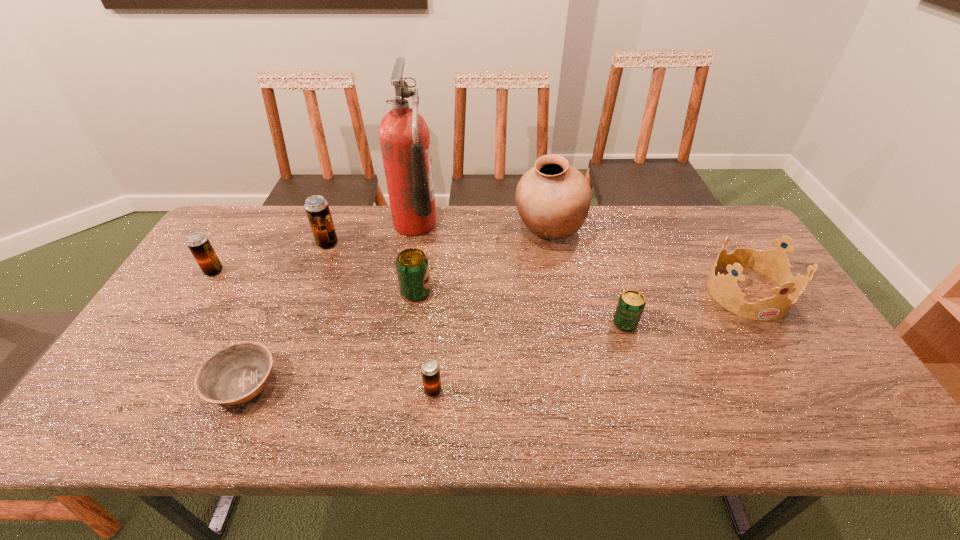
I want to click on red fire extinguisher, so click(x=404, y=137).

You are a GUI agent. You are given a task and a screenshot of the screen. Output one action in this format:
    pyautogui.click(x=<x>, y=<y>)
    Task: Click on the tallest object
    
    Given the screenshot: What is the action you would take?
    pyautogui.click(x=404, y=137)

Identify the location of the eighth shortest object. The width and height of the screenshot is (960, 540). (553, 198).

The image size is (960, 540). Find the location of `pottery`. pottery is located at coordinates (553, 198).

Where is `the farthest black beer can`? The height and width of the screenshot is (540, 960). the farthest black beer can is located at coordinates (317, 209).

The width and height of the screenshot is (960, 540). In order to click on the second beer can from left to right in this screenshot , I will do `click(317, 209)`.

The height and width of the screenshot is (540, 960). What are the coordinates of `tiara` in the screenshot? It's located at (773, 263).

In order to click on the leftmost object in this screenshot , I will do `click(198, 243)`.

I want to click on the second biggest black beer can, so click(x=198, y=243).

The width and height of the screenshot is (960, 540). I want to click on the farther green beer can, so click(x=412, y=267).